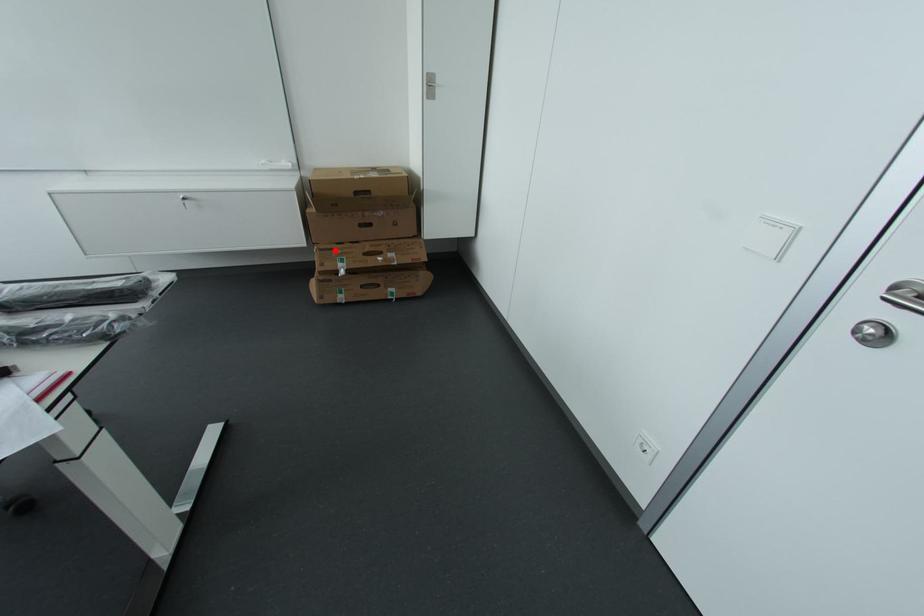
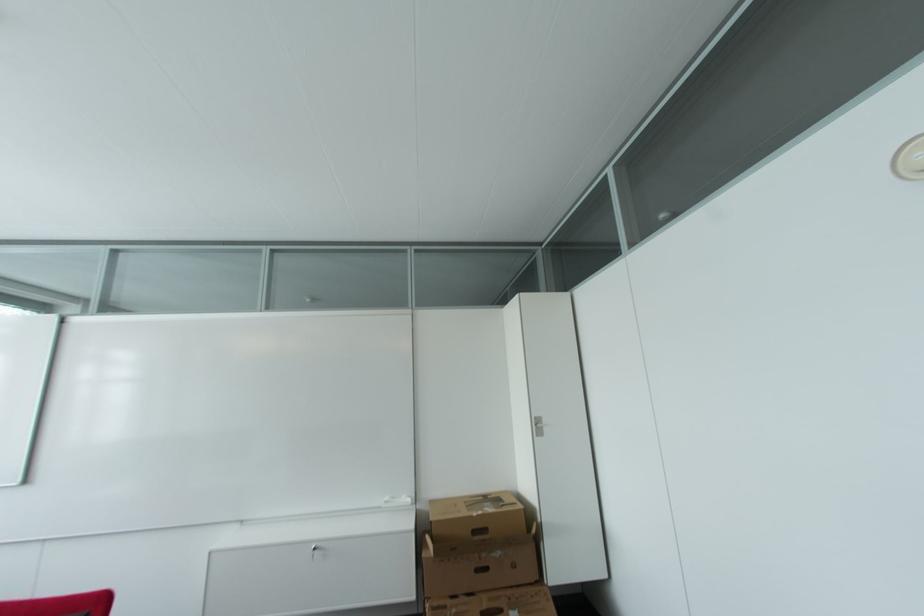
In the second image, find the point that corresponds to the highlighted location in the first image.

(448, 609)